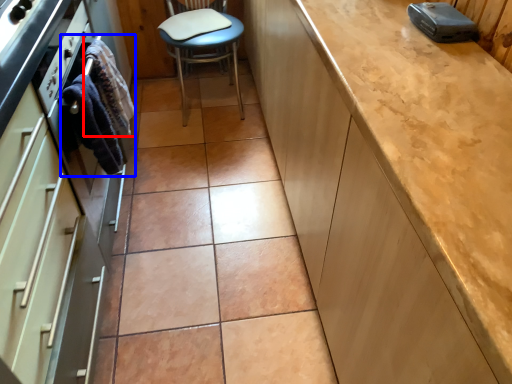
Question: Among these objects, which one is farthest to the camera, material (highlighted by a red box) or material (highlighted by a blue box)?

Choices:
 (A) material
 (B) material

Answer: (A)